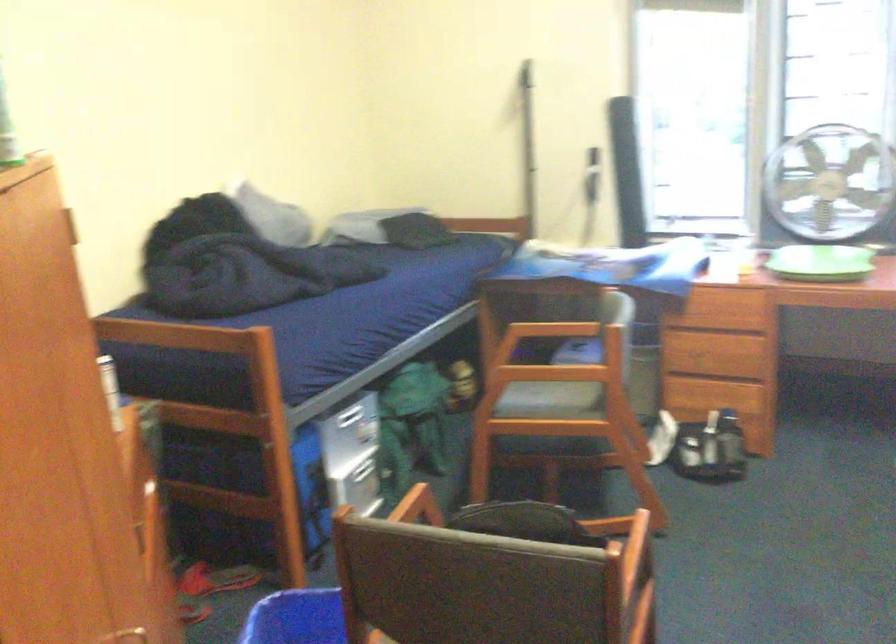
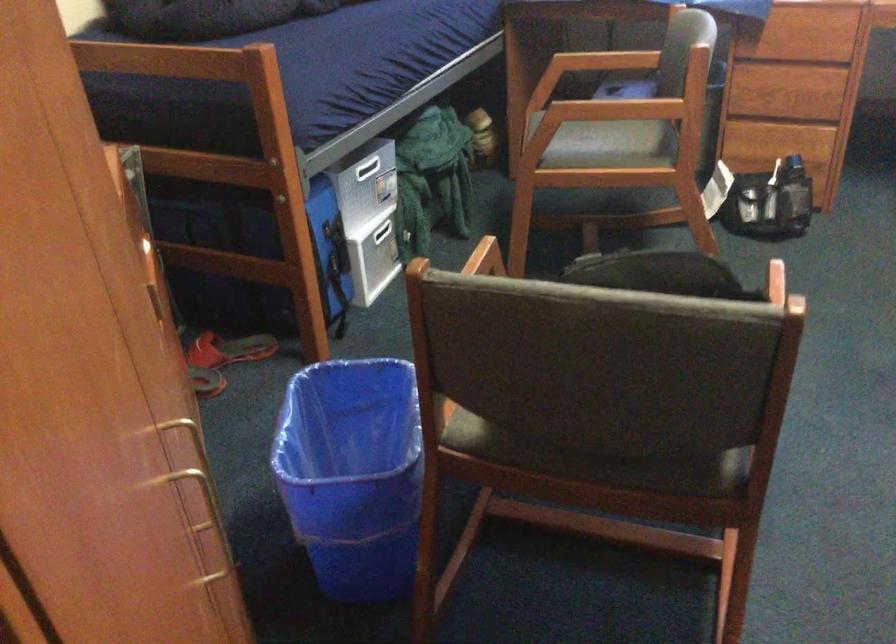
Where in the second image is the point corresponding to (x=719, y=317) from the first image?

(803, 46)